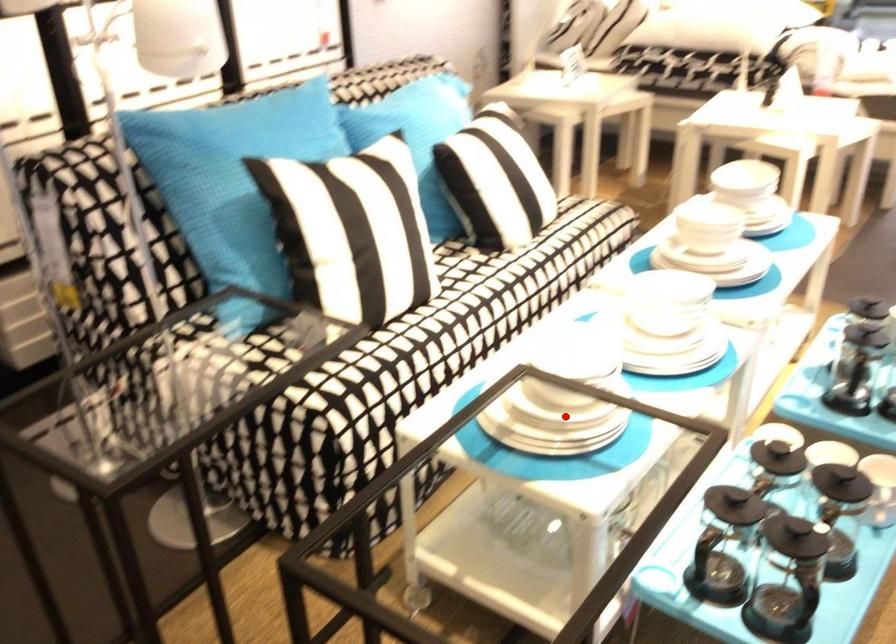
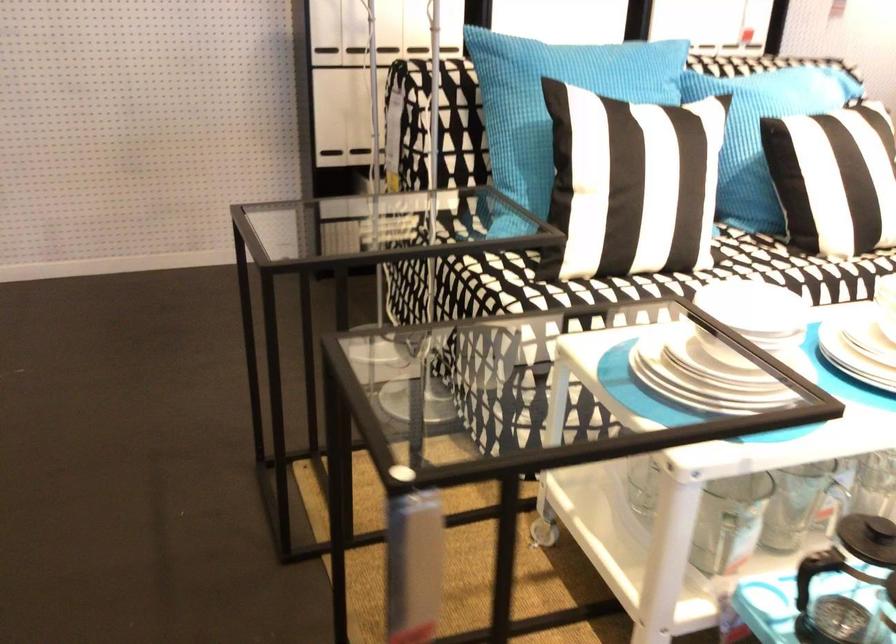
Locate, in the second image, the point that corresponds to the highlighted location in the first image.

(709, 373)